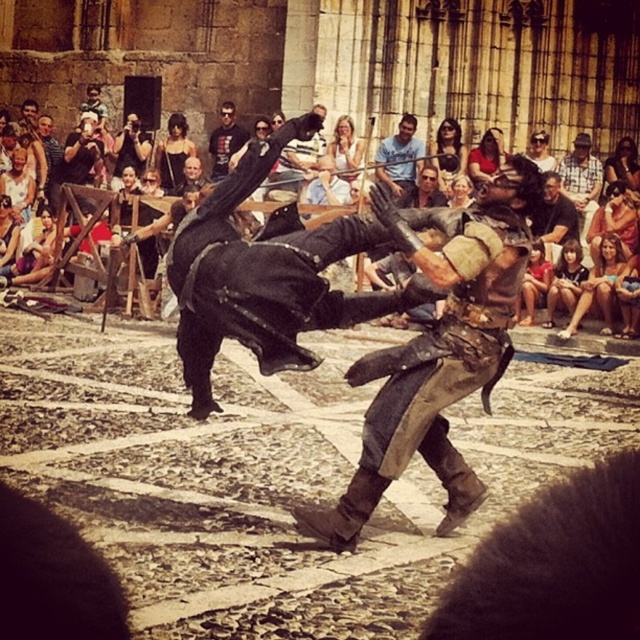
You are a photographer standing at the edge of the demonstration area. You need to capture a photo that includes both the blue denim shirt at center and the brown leather jacket at center. What is the minimum distance you should set your camera lens to focus on to ensure both subjects are in sharp focus?

The minimum focusing distance should be set to 35.76 feet to ensure both the blue denim shirt at center and the brown leather jacket at center are in focus since they are 35.76 feet apart.

Based on the coordinates provided, where is the smooth skin face at lower right located in the image?

The smooth skin face at lower right is located at the 2D coordinates point (564, 282).